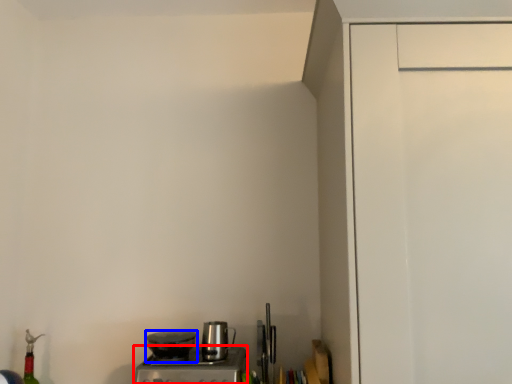
Question: Which of the following is the farthest to the observer, home appliance (highlighted by a red box) or kitchen appliance (highlighted by a blue box)?

Choices:
 (A) home appliance
 (B) kitchen appliance

Answer: (B)